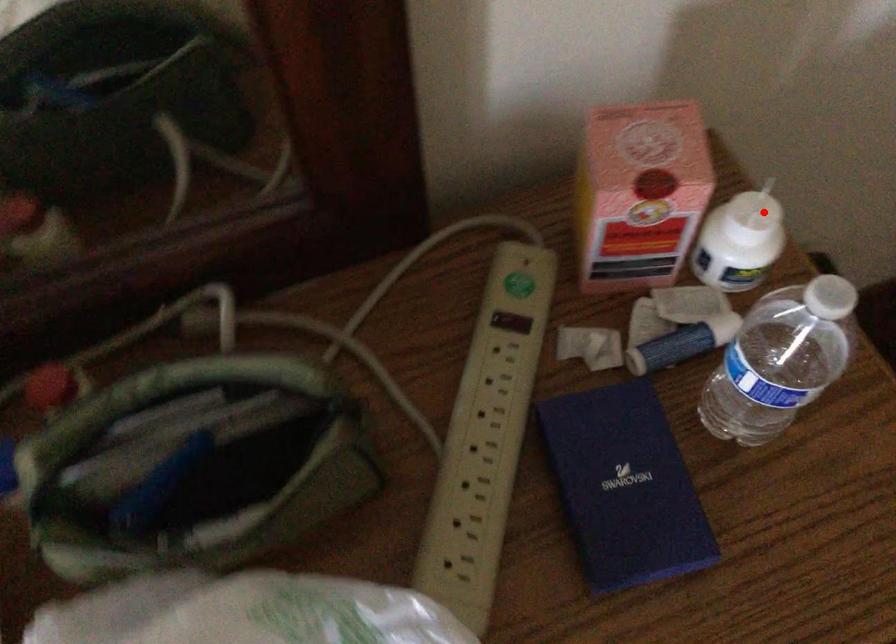
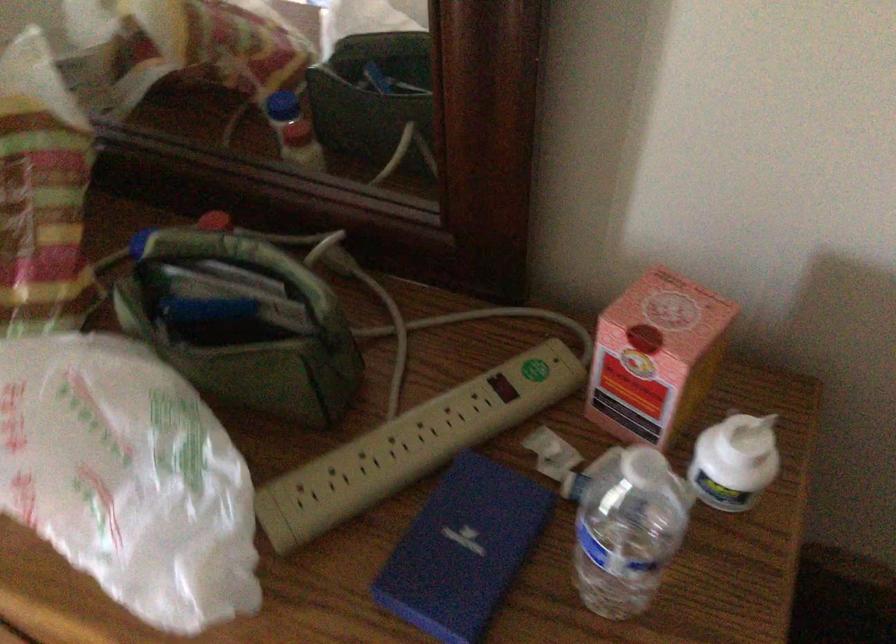
The point at the highlighted location is marked in the first image. Where is the corresponding point in the second image?

(754, 435)